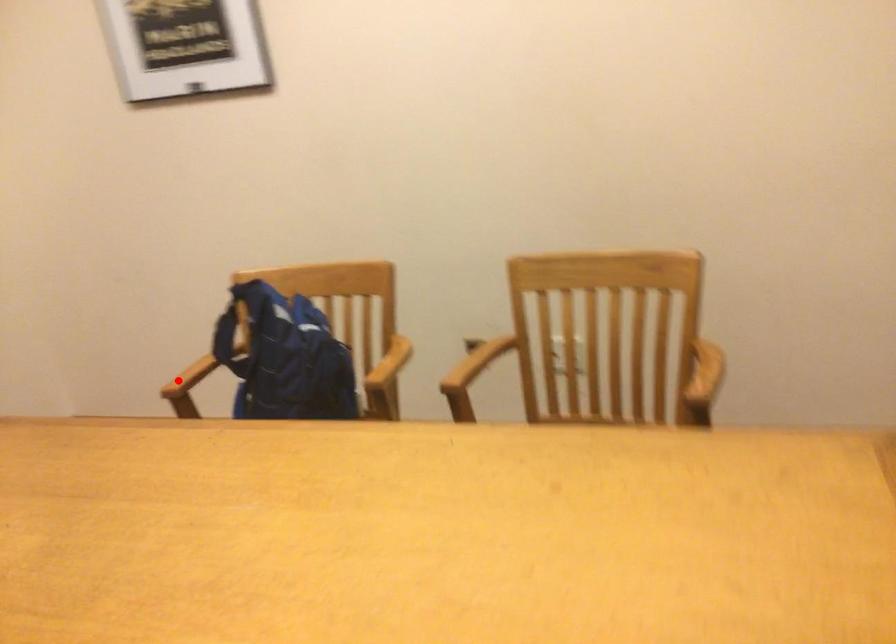
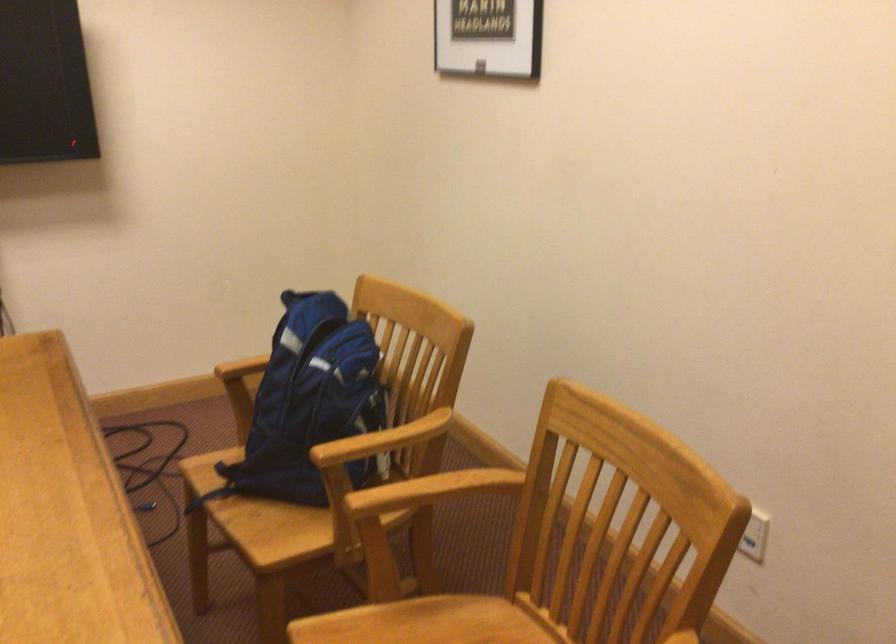
Where in the second image is the point corresponding to the highlighted location from the first image?

(242, 368)